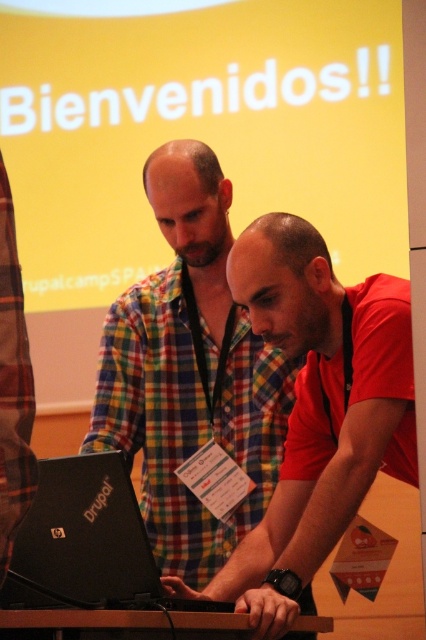
Question: Which point is farther to the camera?

Choices:
 (A) (307, 600)
 (B) (69, 484)
 (C) (13, 611)

Answer: (A)

Question: Is multicolored plaid shirt at center bigger than red matte shirt at center?

Choices:
 (A) no
 (B) yes

Answer: (A)

Question: Is multicolored plaid shirt at center wider than black matte laptop at center?

Choices:
 (A) no
 (B) yes

Answer: (B)

Question: Can you confirm if multicolored plaid shirt at center is positioned below black matte laptop at center?

Choices:
 (A) no
 (B) yes

Answer: (A)

Question: Which object is farther from the camera taking this photo?

Choices:
 (A) red matte shirt at center
 (B) brown wooden table at lower center

Answer: (A)

Question: Estimate the real-world distances between objects in this image. Which object is farther from the multicolored plaid shirt at center?

Choices:
 (A) brown wooden table at lower center
 (B) black matte laptop at center
 (C) red matte shirt at center

Answer: (A)